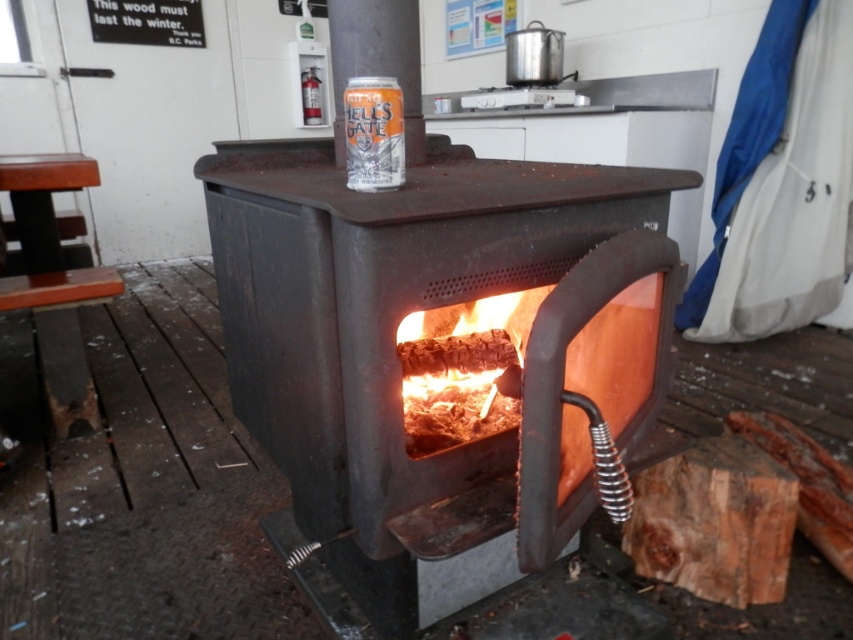
Question: Estimate the real-world distances between objects in this image. Which object is closer to the orange matte can at center?

Choices:
 (A) brown rough wood at lower right
 (B) rusty metal fireplace at center

Answer: (B)

Question: Among these points, which one is farthest from the camera?

Choices:
 (A) coord(654,362)
 (B) coord(387,154)
 (C) coord(737,557)

Answer: (C)

Question: From the image, what is the correct spatial relationship of rusty metal fireplace at center in relation to orange matte can at center?

Choices:
 (A) below
 (B) above

Answer: (A)

Question: Which of the following is the closest to the observer?

Choices:
 (A) (346, 148)
 (B) (722, 486)
 (C) (341, 589)

Answer: (A)

Question: Does rusty metal fireplace at center have a greater width compared to brown rough wood at lower right?

Choices:
 (A) no
 (B) yes

Answer: (B)

Question: From the image, what is the correct spatial relationship of rusty metal fireplace at center in relation to orange matte can at center?

Choices:
 (A) right
 (B) left

Answer: (A)